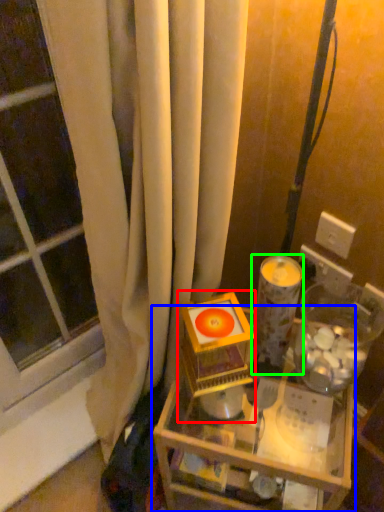
Question: Which object is the closest to the toy (highlighted by a red box)? Choose among these: table (highlighted by a blue box) or candle holder (highlighted by a green box).

Choices:
 (A) table
 (B) candle holder

Answer: (B)